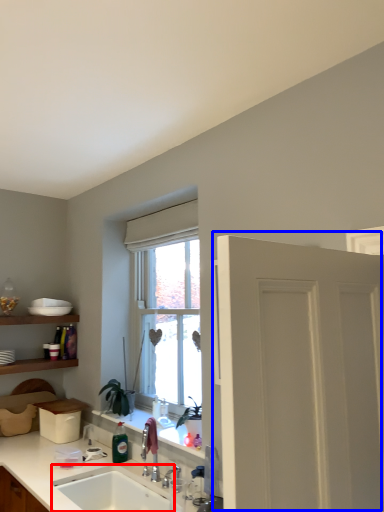
Question: Which object appears closest to the camera in this image, sink (highlighted by a red box) or door (highlighted by a blue box)?

Choices:
 (A) sink
 (B) door

Answer: (B)